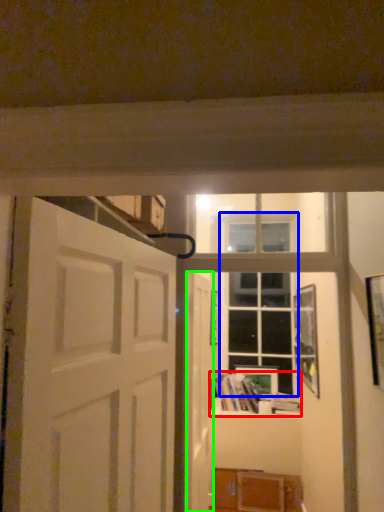
Question: Based on their relative distances, which object is nearer to book (highlighted by a red box)? Choose from window (highlighted by a blue box) and door (highlighted by a green box).

Choices:
 (A) window
 (B) door

Answer: (A)